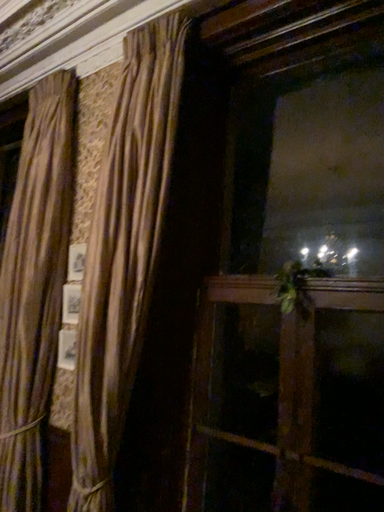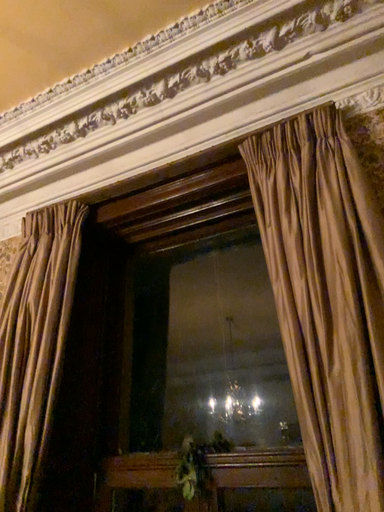
Question: How did the camera likely rotate when shooting the video?

Choices:
 (A) rotated left
 (B) rotated right

Answer: (B)